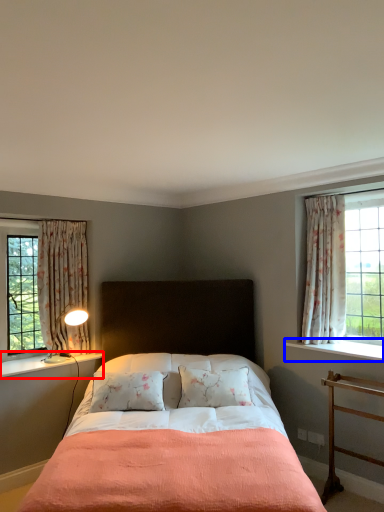
Question: Among these objects, which one is nearest to the camera, window sill (highlighted by a red box) or window sill (highlighted by a blue box)?

Choices:
 (A) window sill
 (B) window sill

Answer: (B)